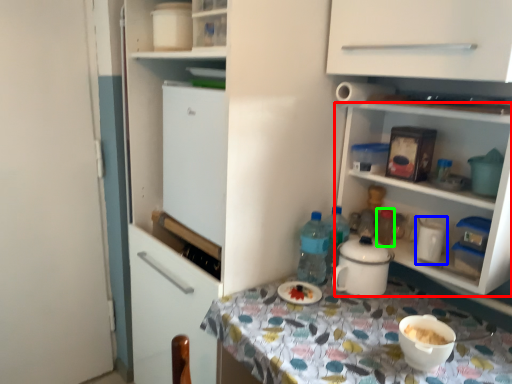
Question: Which object is positioned closest to shelf (highlighted by a red box)? Select from appliance (highlighted by a blue box) and bottle (highlighted by a green box).

Choices:
 (A) appliance
 (B) bottle

Answer: (A)